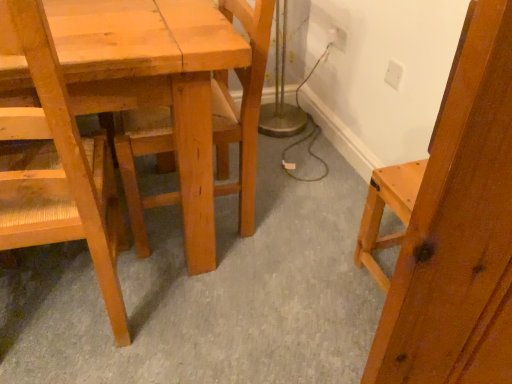
Question: Should I look upward or downward to see natural wood chair at center, which is the second chair from left to right?

Choices:
 (A) up
 (B) down

Answer: (A)

Question: Are white plastic electric outlet at upper right, which appears as the 2th electric outlet when ordered from the bottom, and natural wood chair at center, the 1th chair positioned from the right, located far from each other?

Choices:
 (A) no
 (B) yes

Answer: (A)

Question: Can you confirm if white plastic electric outlet at upper right, the 1th electric outlet positioned from the back, is shorter than natural wood chair at center, which is the second chair from left to right?

Choices:
 (A) no
 (B) yes

Answer: (B)

Question: Is white plastic electric outlet at upper right, the 1th electric outlet from the left, at the right side of natural wood chair at center, which is the second chair from left to right?

Choices:
 (A) yes
 (B) no

Answer: (A)

Question: Can you confirm if white plastic electric outlet at upper right, positioned as the 1th electric outlet in top-to-bottom order, is taller than natural wood chair at center, which is the second chair from left to right?

Choices:
 (A) no
 (B) yes

Answer: (A)

Question: Does white plastic electric outlet at upper right, which is the second electric outlet in right-to-left order, have a greater width compared to natural wood chair at center, which is the second chair from left to right?

Choices:
 (A) no
 (B) yes

Answer: (A)

Question: Is the depth of white plastic electric outlet at upper right, the 1th electric outlet from the left, less than that of natural wood chair at center, the 1th chair positioned from the right?

Choices:
 (A) no
 (B) yes

Answer: (A)

Question: Is white plastic electric outlet at upper right, the first electric outlet viewed from the right, turned away from natural wood chair at left, acting as the first chair starting from the left?

Choices:
 (A) no
 (B) yes

Answer: (A)

Question: From a real-world perspective, does white plastic electric outlet at upper right, the 1th electric outlet from the front, stand above natural wood chair at left, the second chair positioned from the right?

Choices:
 (A) yes
 (B) no

Answer: (A)

Question: From the image's perspective, is white plastic electric outlet at upper right, the first electric outlet in the bottom-to-top sequence, under natural wood chair at left, the second chair positioned from the right?

Choices:
 (A) yes
 (B) no

Answer: (B)

Question: Is the depth of white plastic electric outlet at upper right, arranged as the 2th electric outlet when viewed from the left, greater than that of natural wood chair at left, acting as the first chair starting from the left?

Choices:
 (A) no
 (B) yes

Answer: (B)

Question: From the image's perspective, would you say white plastic electric outlet at upper right, the first electric outlet in the bottom-to-top sequence, is positioned over natural wood chair at left, the second chair positioned from the right?

Choices:
 (A) yes
 (B) no

Answer: (A)

Question: Are white plastic electric outlet at upper right, the first electric outlet in the bottom-to-top sequence, and natural wood chair at left, acting as the first chair starting from the left, beside each other?

Choices:
 (A) no
 (B) yes

Answer: (A)

Question: Is white plastic electric outlet at upper right, which is the second electric outlet in right-to-left order, completely or partially inside white plastic electric outlet at upper right, the first electric outlet in the bottom-to-top sequence?

Choices:
 (A) yes
 (B) no

Answer: (B)